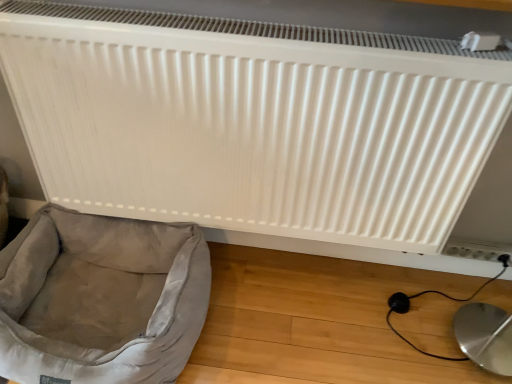
Question: Does light gray fabric dog bed at lower left have a smaller size compared to white plastic electric outlet at lower right?

Choices:
 (A) yes
 (B) no

Answer: (B)

Question: Is light gray fabric dog bed at lower left taller than white plastic electric outlet at lower right?

Choices:
 (A) no
 (B) yes

Answer: (B)

Question: Is light gray fabric dog bed at lower left placed right next to white plastic electric outlet at lower right?

Choices:
 (A) no
 (B) yes

Answer: (A)

Question: Can you confirm if light gray fabric dog bed at lower left is positioned to the left of white plastic electric outlet at lower right?

Choices:
 (A) no
 (B) yes

Answer: (B)

Question: Could you tell me if light gray fabric dog bed at lower left is facing white plastic electric outlet at lower right?

Choices:
 (A) yes
 (B) no

Answer: (B)

Question: From the image's perspective, is light gray fabric dog bed at lower left on top of white plastic electric outlet at lower right?

Choices:
 (A) no
 (B) yes

Answer: (A)

Question: Is white plastic electric outlet at lower right completely or partially inside white matte radiator at upper center?

Choices:
 (A) yes
 (B) no

Answer: (B)

Question: Is white matte radiator at upper center facing towards white plastic electric outlet at lower right?

Choices:
 (A) no
 (B) yes

Answer: (A)

Question: Is white matte radiator at upper center smaller than white plastic electric outlet at lower right?

Choices:
 (A) no
 (B) yes

Answer: (A)

Question: Is white matte radiator at upper center not near white plastic electric outlet at lower right?

Choices:
 (A) yes
 (B) no

Answer: (B)

Question: Are white matte radiator at upper center and white plastic electric outlet at lower right making contact?

Choices:
 (A) no
 (B) yes

Answer: (A)

Question: Can you confirm if white matte radiator at upper center is wider than white plastic electric outlet at lower right?

Choices:
 (A) yes
 (B) no

Answer: (A)

Question: Are white plastic electric outlet at lower right and light gray fabric dog bed at lower left located far from each other?

Choices:
 (A) yes
 (B) no

Answer: (A)